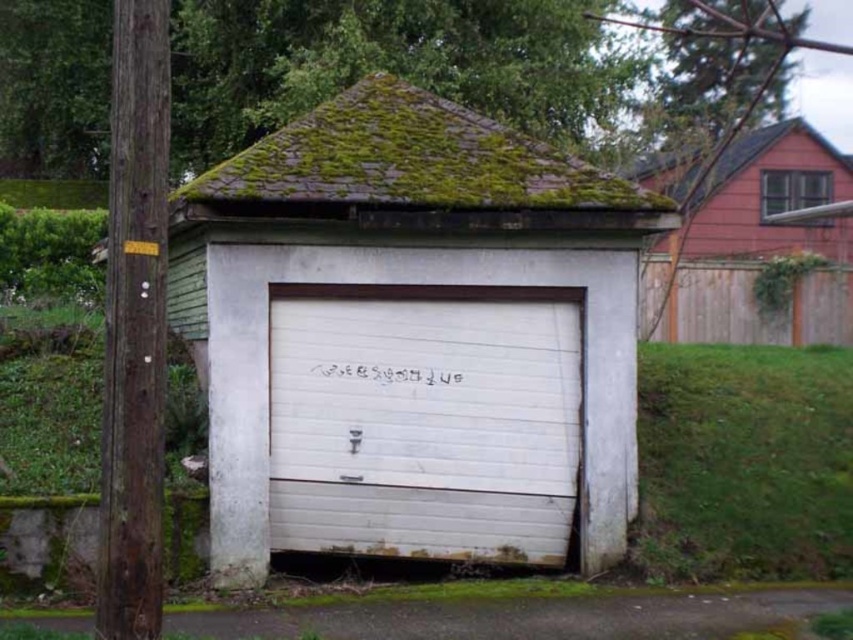
Is point (503, 429) closer to viewer compared to point (780, 168)?

Yes, point (503, 429) is in front of point (780, 168).

Which of these two, white matte garage door at center or red wood fence at upper right, stands shorter?

white matte garage door at center is shorter.

What are the coordinates of `white matte garage door at center` in the screenshot? It's located at (413, 337).

Who is shorter, white matte garage door at center or weathered brown wood at left?

weathered brown wood at left

Measure the distance from white matte garage door at center to weathered brown wood at left.

They are 13.17 feet apart.

What do you see at coordinates (413, 337) in the screenshot? This screenshot has height=640, width=853. I see `white matte garage door at center` at bounding box center [413, 337].

This screenshot has width=853, height=640. Identify the location of white matte garage door at center. (413, 337).

Can you confirm if white painted wood garage door at center is positioned below green mossy shingles at upper center?

Correct, white painted wood garage door at center is located below green mossy shingles at upper center.

Measure the distance between point (399, 529) and camera.

Point (399, 529) is 9.80 meters away from camera.

At what (x,y) coordinates should I click in order to perform the action: click on white painted wood garage door at center. Please return your answer as a coordinate pair (x, y). This screenshot has height=640, width=853. Looking at the image, I should click on (424, 420).